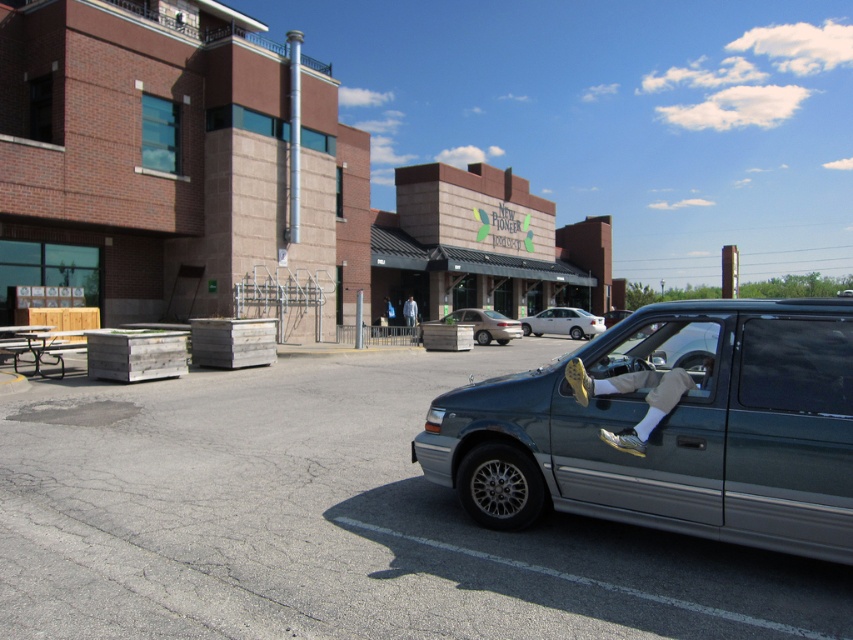
What is the 2D coordinate of the asphalt at center in the image?

The 2D coordinate of the asphalt at center is at point (334, 522).